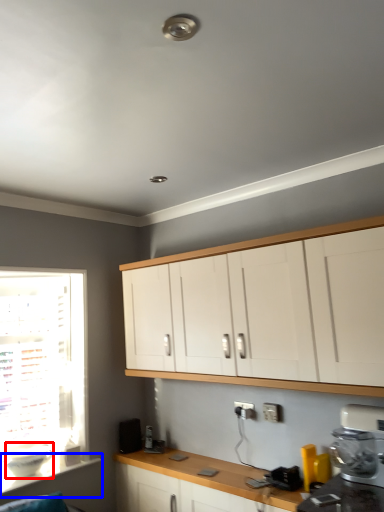
Question: Which object is closer to the camera taking this photo, appliance (highlighted by a red box) or window sill (highlighted by a blue box)?

Choices:
 (A) appliance
 (B) window sill

Answer: (B)